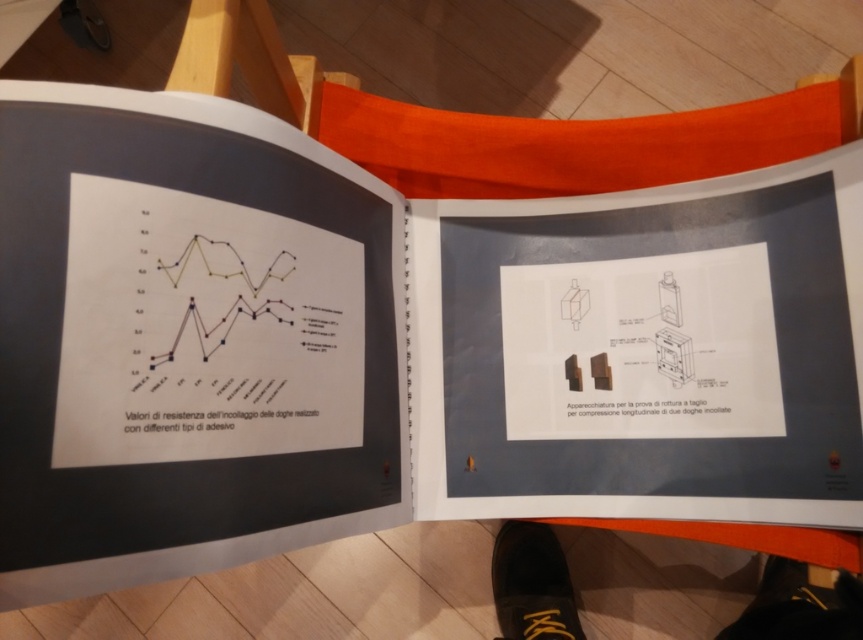
Does point (742, 625) come farther from viewer compared to point (565, 624)?

No, (742, 625) is in front of (565, 624).

Is black leather shoe at lower right positioned in front of black leather shoe at lower center?

Yes, it is in front of black leather shoe at lower center.

Does point (860, 588) come farther from viewer compared to point (553, 611)?

No.

The image size is (863, 640). Identify the location of black leather shoe at lower right. (532, 584).